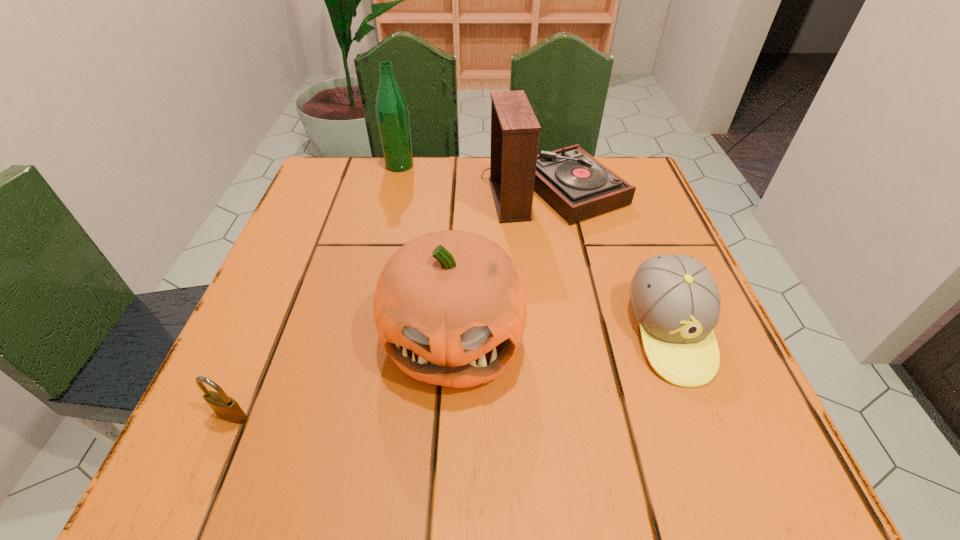
Where is `the second object from left to right`? the second object from left to right is located at coordinates (391, 108).

Where is `phonograph record`? phonograph record is located at coordinates (578, 186).

This screenshot has height=540, width=960. I want to click on pumpkin, so click(x=450, y=308).

You are a GUI agent. You are given a task and a screenshot of the screen. Output one action in this format:
    pyautogui.click(x=<x>, y=<y>)
    Task: Click on the baseball cap
    This screenshot has width=960, height=540.
    Given the screenshot: What is the action you would take?
    point(675,299)

You are a GUI agent. You are given a task and a screenshot of the screen. Output one action in this format:
    pyautogui.click(x=<x>, y=<y>)
    Task: Click on the nearest object
    This screenshot has width=960, height=540.
    Given the screenshot: What is the action you would take?
    pyautogui.click(x=227, y=408)

Find the location of a particular element. The height and width of the screenshot is (540, 960). the leftmost object is located at coordinates (227, 408).

Where is `free space located 0.080m on the left of the bottle`? free space located 0.080m on the left of the bottle is located at coordinates (350, 165).

Identify the location of free point located 0.230m on the front of the phonograph record. This screenshot has width=960, height=540. (579, 316).

At what (x,y) coordinates should I click in order to perform the action: click on blank area located on the face of the pumpkin. Please return your answer as a coordinate pair (x, y). Looking at the image, I should click on (447, 442).

Find the location of `free spot located on the front-facing side of the fourth tallest object`. free spot located on the front-facing side of the fourth tallest object is located at coordinates (715, 452).